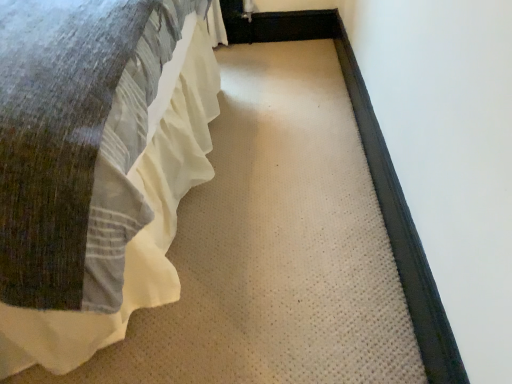
Describe the element at coordinates (95, 166) in the screenshot. I see `white cotton bed at left` at that location.

Where is `white cotton bed at left`? This screenshot has height=384, width=512. white cotton bed at left is located at coordinates (95, 166).

In order to click on black rubber doormat at right in this screenshot , I will do `click(400, 227)`.

The height and width of the screenshot is (384, 512). What do you see at coordinates (400, 227) in the screenshot?
I see `black rubber doormat at right` at bounding box center [400, 227].

The image size is (512, 384). I want to click on white cotton bed at left, so click(x=95, y=166).

Is black rubber doormat at right to the left or to the right of white cotton bed at left in the image?

Based on their positions, black rubber doormat at right is located to the right of white cotton bed at left.

Based on the photo, which object is closer to the camera, black rubber doormat at right or white cotton bed at left?

white cotton bed at left is more forward.

Which point is more forward, (x=408, y=261) or (x=72, y=320)?

The point (x=72, y=320) is more forward.

From the image's perspective, would you say black rubber doormat at right is shown under white cotton bed at left?

Yes, from the image's perspective, black rubber doormat at right is below white cotton bed at left.

From a real-world perspective, who is located lower, black rubber doormat at right or white cotton bed at left?

From a 3D spatial view, black rubber doormat at right is below.

Considering the relative sizes of black rubber doormat at right and white cotton bed at left in the image provided, is black rubber doormat at right wider than white cotton bed at left?

In fact, black rubber doormat at right might be narrower than white cotton bed at left.

Considering the sizes of objects black rubber doormat at right and white cotton bed at left in the image provided, who is taller, black rubber doormat at right or white cotton bed at left?

white cotton bed at left is taller.

Between black rubber doormat at right and white cotton bed at left, which one has smaller size?

black rubber doormat at right is smaller.

Is black rubber doormat at right completely or partially outside of white cotton bed at left?

Yes, black rubber doormat at right is outside of white cotton bed at left.

Does black rubber doormat at right touch white cotton bed at left?

black rubber doormat at right and white cotton bed at left are not in contact.

Is black rubber doormat at right facing towards white cotton bed at left?

Yes, black rubber doormat at right is turned towards white cotton bed at left.

From the picture: How many degrees apart are the facing directions of black rubber doormat at right and white cotton bed at left?

They differ by 180 degrees in their facing directions.

You are a GUI agent. You are given a task and a screenshot of the screen. Output one action in this format:
    pyautogui.click(x=<x>, y=<y>)
    Task: Click on the bed that appears in front of the black rubber doormat at right
    The image size is (512, 384).
    Given the screenshot: What is the action you would take?
    pyautogui.click(x=95, y=166)

Which object is positioned more to the right, white cotton bed at left or black rubber doormat at right?

black rubber doormat at right is more to the right.

Relative to black rubber doormat at right, is white cotton bed at left in front or behind?

Visually, white cotton bed at left is located in front of black rubber doormat at right.

Which point is more distant from viewer, (x=149, y=34) or (x=423, y=267)?

The point (x=149, y=34) is more distant.

From the image's perspective, is white cotton bed at left located above or below black rubber doormat at right?

Based on their image positions, white cotton bed at left is located above black rubber doormat at right.

Based on the photo, from a real-world perspective, is white cotton bed at left physically below black rubber doormat at right?

No, from a real-world perspective, white cotton bed at left is not under black rubber doormat at right.

Which of these two, white cotton bed at left or black rubber doormat at right, is wider?

With larger width is white cotton bed at left.

From their relative heights in the image, would you say white cotton bed at left is taller or shorter than black rubber doormat at right?

A: Clearly, white cotton bed at left is taller compared to black rubber doormat at right.

Who is bigger, white cotton bed at left or black rubber doormat at right?

white cotton bed at left.

Is black rubber doormat at right completely or partially inside white cotton bed at left?

That's incorrect, black rubber doormat at right is not inside white cotton bed at left.

Is the surface of white cotton bed at left in direct contact with black rubber doormat at right?

No, white cotton bed at left is not with black rubber doormat at right.

Is black rubber doormat at right at the back of white cotton bed at left?

No.

How many degrees apart are the facing directions of white cotton bed at left and black rubber doormat at right?

They differ by 180 degrees in their facing directions.

Identify the location of doormat below the white cotton bed at left (from a real-world perspective). The image size is (512, 384). (400, 227).

In the image, there is a black rubber doormat at right. In order to click on bed above it (from the image's perspective) in this screenshot , I will do `click(95, 166)`.

Where is `doormat behind the white cotton bed at left`? The image size is (512, 384). doormat behind the white cotton bed at left is located at coordinates (400, 227).